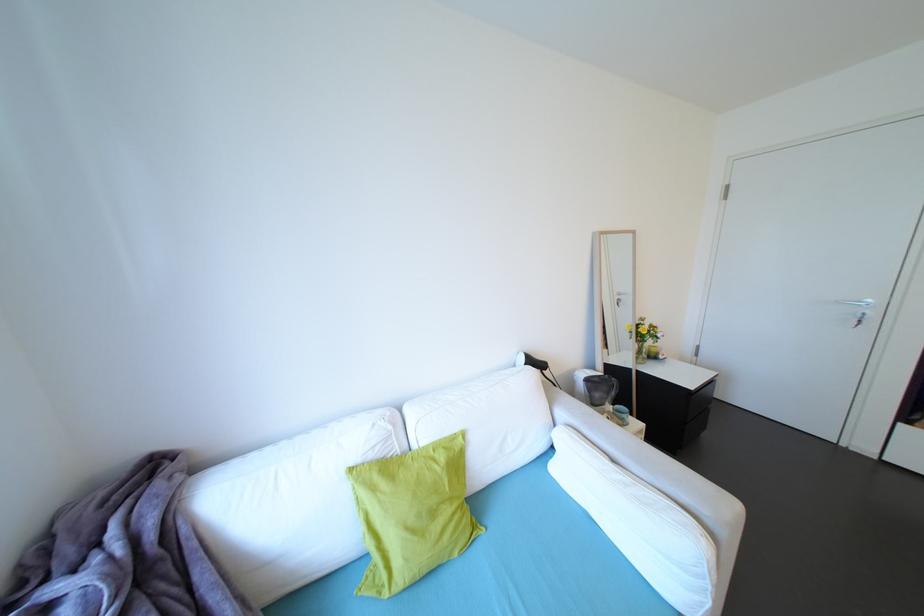
At what (x,y) coordinates should I click in order to perform the action: click on black pitcher. Please return your answer as a coordinate pair (x, y). Image resolution: width=924 pixels, height=616 pixels. Looking at the image, I should click on (600, 390).